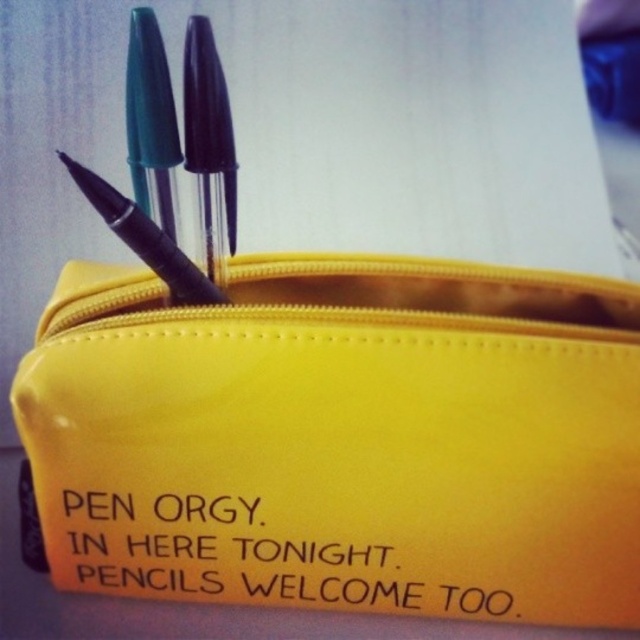
You are an organizer trying to place a new sticker on the yellow pencil case. The sticker has coordinates given as a point at (342,438). Where on the pencil case should you place the sticker?

The point at (342,438) corresponds to the yellow vinyl pouch at center, so you should place the sticker on the yellow vinyl pouch at center.

You are organizing a stationery drawer and need to place the yellow vinyl pouch at center and the matte black pencil at upper center. Given their widths, which one requires more horizontal space to store?

The yellow vinyl pouch at center requires more horizontal space because its width surpasses that of the matte black pencil at upper center.

You are designing a sticker to place on the yellow vinyl pouch at center and the yellow matte text at center. Which object should the sticker be placed on if you want it to be more visible from above?

The sticker should be placed on the yellow vinyl pouch at center because it has a greater height compared to the yellow matte text at center, making it more visible from above.